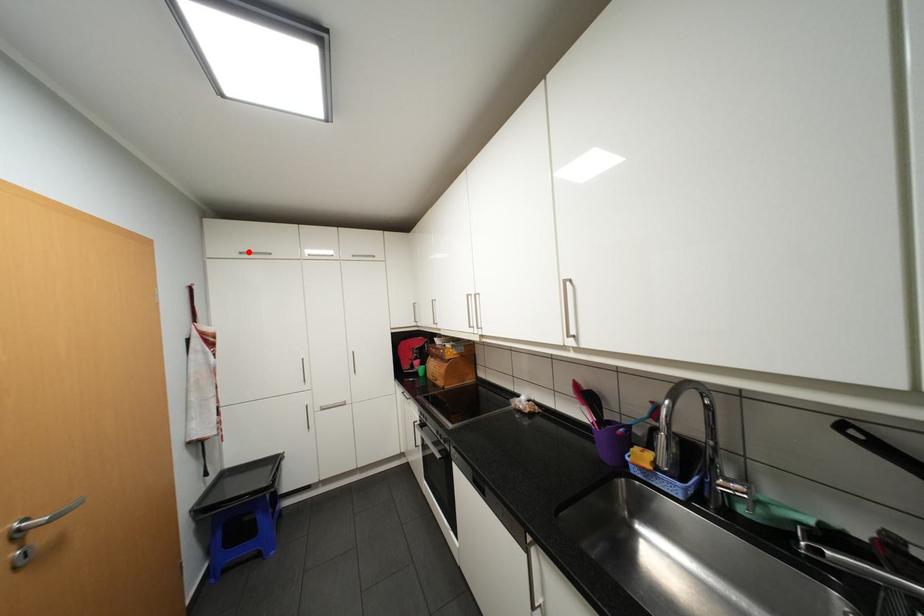
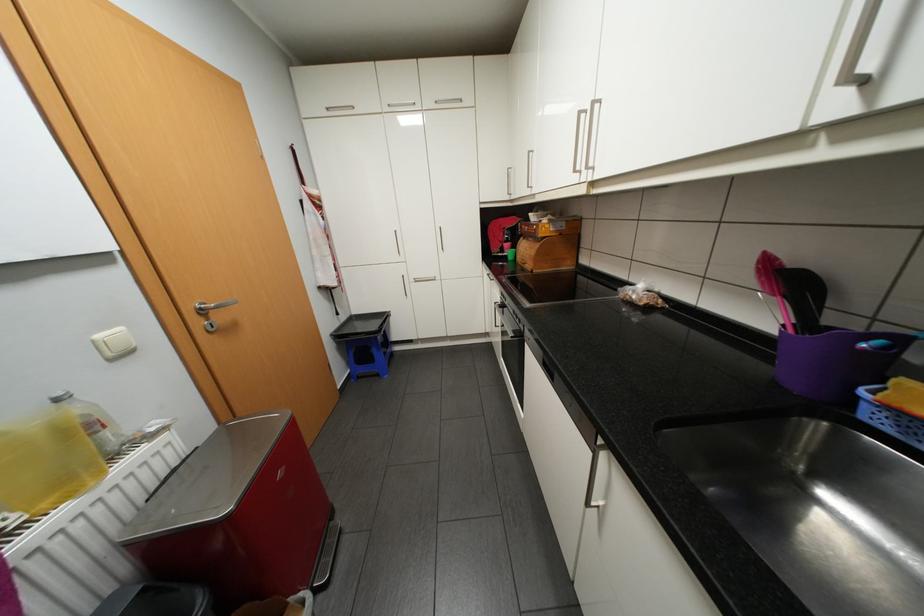
Find the pixel in the second image that matches the highlighted location in the first image.

(335, 108)